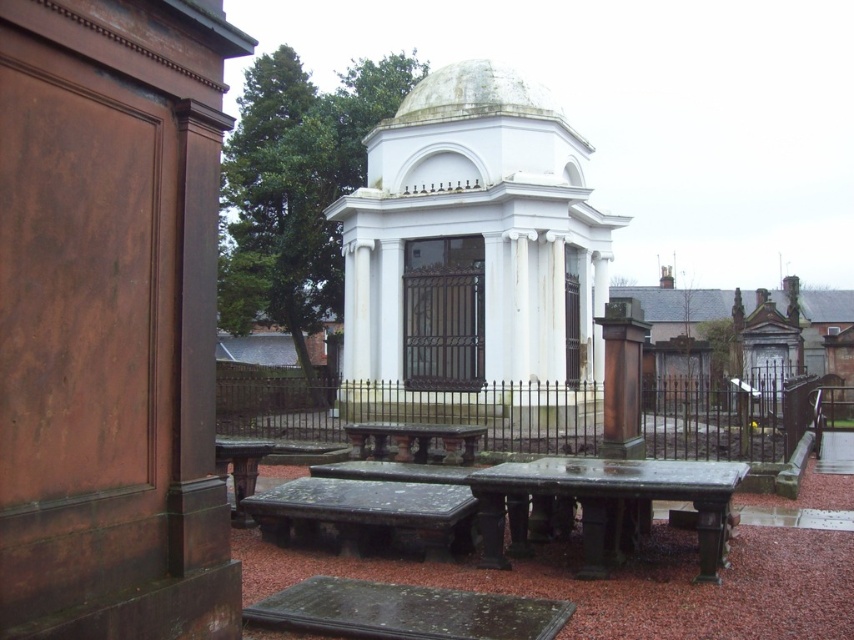
Is white marble chapel at center taller than dark gray stone picnic table at center?

Correct, white marble chapel at center is much taller as dark gray stone picnic table at center.

Who is more forward, (477, 236) or (705, 502)?

Point (705, 502) is in front.

Who is more forward, (480, 317) or (714, 497)?

Point (714, 497) is in front.

What are the coordinates of `white marble chapel at center` in the screenshot? It's located at (471, 252).

Who is more distant from viewer, [375,248] or [232,456]?

The point [375,248] is more distant.

The image size is (854, 640). What do you see at coordinates (471, 252) in the screenshot?
I see `white marble chapel at center` at bounding box center [471, 252].

This screenshot has height=640, width=854. I want to click on white marble chapel at center, so pos(471,252).

Between point (302, 536) and point (461, 442), which one is positioned in front?

Positioned in front is point (302, 536).

Can you confirm if polished stone bench at center is smaller than polished stone table at center?

No, polished stone bench at center is not smaller than polished stone table at center.

I want to click on polished stone bench at center, so click(366, 513).